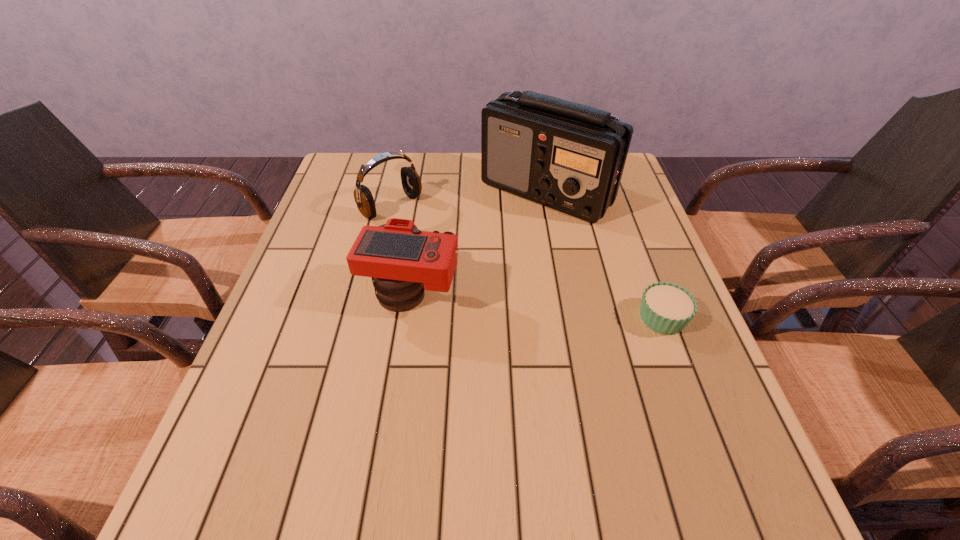
Where is `camera`? camera is located at coordinates (402, 261).

Identify the location of the shortest object. (666, 308).

At what (x,y) coordinates should I click in order to perform the action: click on headset. Please return your answer as a coordinate pair (x, y). This screenshot has height=540, width=960. Looking at the image, I should click on (411, 182).

Image resolution: width=960 pixels, height=540 pixels. I want to click on the tallest object, so tap(570, 157).

Find the location of a particular element. vacant space positioned on the right of the camera is located at coordinates (496, 293).

Where is `blank space located 0.240m on the front of the cupcake`? The width and height of the screenshot is (960, 540). blank space located 0.240m on the front of the cupcake is located at coordinates point(712,451).

This screenshot has height=540, width=960. I want to click on vacant space located on the ear cups of the headset, so click(481, 278).

In order to click on vacant space located 0.080m on the ear cups of the headset in this screenshot , I will do `click(426, 234)`.

Where is `vacant space located on the ear cups of the headset`? Image resolution: width=960 pixels, height=540 pixels. vacant space located on the ear cups of the headset is located at coordinates (431, 237).

This screenshot has height=540, width=960. Identify the location of free region located 0.350m on the front panel of the tallest object. (551, 328).